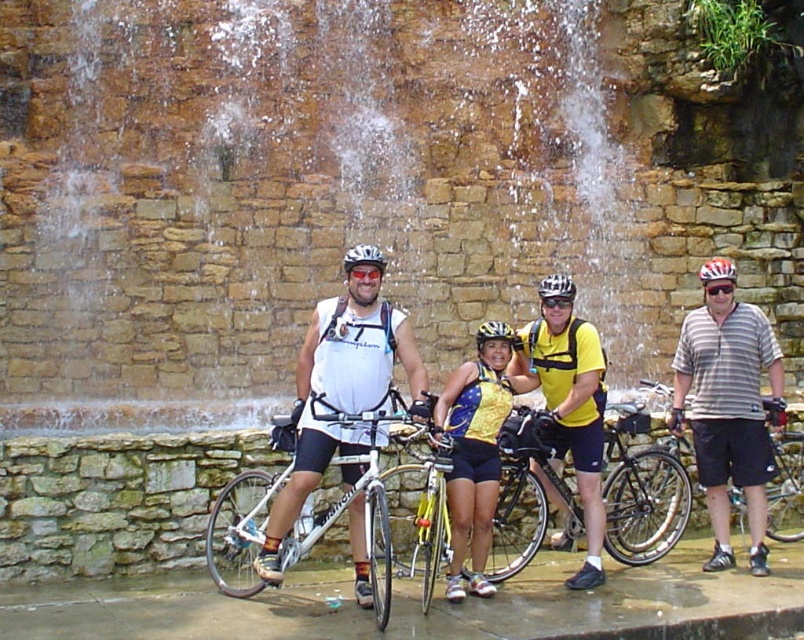
Does point (649, 541) come in front of point (544, 320)?

Yes, point (649, 541) is closer to viewer.

Is shiny metallic bicycle at center further to the viewer compared to matte black helmet at center?

No.

Describe the element at coordinates (642, 492) in the screenshot. This screenshot has height=640, width=804. I see `shiny metallic bicycle at center` at that location.

The image size is (804, 640). Find the location of `shiny metallic bicycle at center`. shiny metallic bicycle at center is located at coordinates (642, 492).

Who is higher up, brown stone waterfall at center or silver metallic bicycle at center?

brown stone waterfall at center is above.

Measure the distance between brown stone waterfall at center and camera.

The distance of brown stone waterfall at center from camera is 40.12 meters.

Does point (126, 316) come in front of point (651, 388)?

Yes.

I want to click on brown stone waterfall at center, so click(286, 189).

Can you confirm if yellow matte shirt at center is taller than black matte goggles at center?

Correct, yellow matte shirt at center is much taller as black matte goggles at center.

Looking at this image, is yellow matte shirt at center smaller than black matte goggles at center?

No.

This screenshot has width=804, height=640. I want to click on yellow matte shirt at center, so click(569, 412).